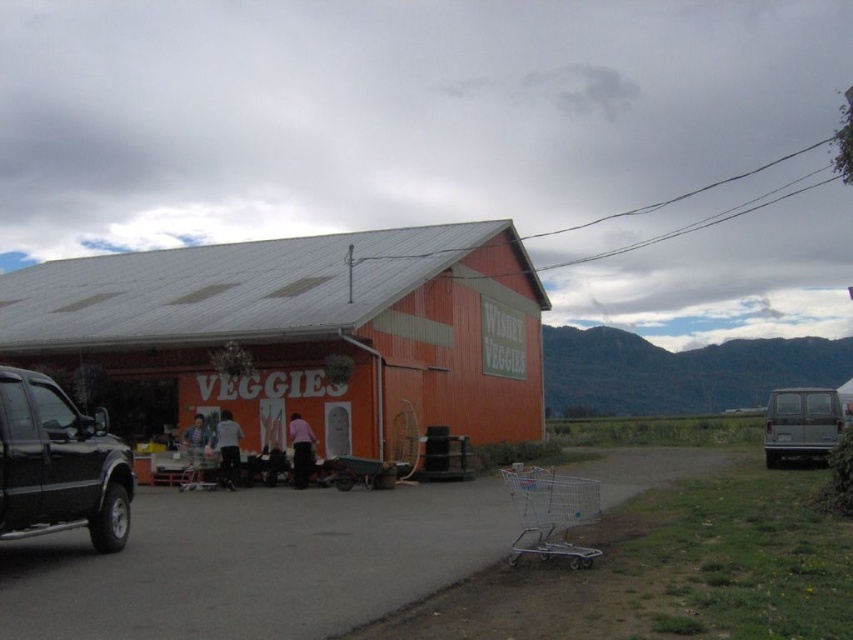
Consider the image. Is orange corrugated metal barn at center in front of black matte truck at left?

No, orange corrugated metal barn at center is further to the viewer.

What do you see at coordinates (300, 336) in the screenshot? This screenshot has height=640, width=853. I see `orange corrugated metal barn at center` at bounding box center [300, 336].

Identify the location of orange corrugated metal barn at center. Image resolution: width=853 pixels, height=640 pixels. (300, 336).

Can you confirm if black matte truck at left is positioned above gray matte van at right?

Correct, black matte truck at left is located above gray matte van at right.

Does black matte truck at left have a smaller size compared to gray matte van at right?

Yes, black matte truck at left is smaller than gray matte van at right.

Where is `black matte truck at left`? black matte truck at left is located at coordinates (59, 465).

Find the location of a particular element. This screenshot has height=640, width=853. black matte truck at left is located at coordinates (59, 465).

Can you confirm if orange corrugated metal barn at center is positioned to the left of gray matte van at right?

Indeed, orange corrugated metal barn at center is positioned on the left side of gray matte van at right.

Is orange corrugated metal barn at center below gray matte van at right?

Incorrect, orange corrugated metal barn at center is not positioned below gray matte van at right.

Is point (103, 332) farther from viewer compared to point (807, 451)?

Yes, point (103, 332) is farther from viewer.

You are a GUI agent. You are given a task and a screenshot of the screen. Output one action in this format:
    pyautogui.click(x=<x>, y=<y>)
    Task: Click on the orange corrugated metal barn at center
    
    Given the screenshot: What is the action you would take?
    pyautogui.click(x=300, y=336)